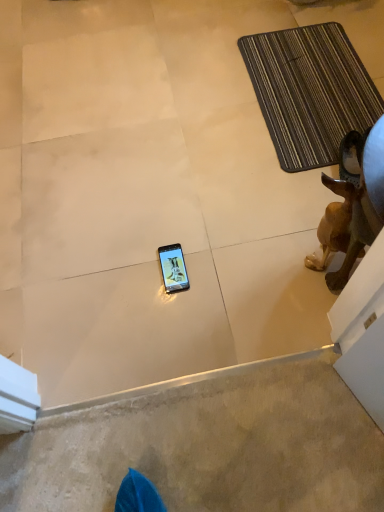
This screenshot has width=384, height=512. What are the coordinates of `vacant space that is to the left of brown striped bath mat at upper right` in the screenshot? It's located at (179, 126).